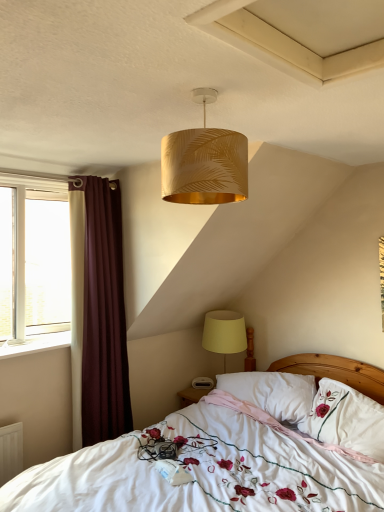
Question: Choose the correct answer: Is white soft pillow at center, which is the first pillow from left to right, inside burgundy fabric curtain at left or outside it?

Choices:
 (A) outside
 (B) inside

Answer: (A)

Question: From a real-world perspective, is white soft pillow at center, which is the first pillow from left to right, above or below burgundy fabric curtain at left?

Choices:
 (A) below
 (B) above

Answer: (A)

Question: Which object is the farthest from the white soft pillow at center, the 2th pillow in the right-to-left sequence?

Choices:
 (A) yellow fabric lampshade at lower right, which is the first lamp from bottom to top
 (B) gold leaf-patterned lampshade at upper center, acting as the first lamp starting from the top
 (C) white plastic window sill at left
 (D) burgundy fabric curtain at left
 (E) white embroidered pillow at center, which ranks as the second pillow in left-to-right order

Answer: (B)

Question: Which object is positioned closest to the yellow fabric lampshade at lower right, which is the first lamp from bottom to top?

Choices:
 (A) white plastic window sill at left
 (B) white soft pillow at center, which is the first pillow from left to right
 (C) white embroidered bed at center
 (D) gold leaf-patterned lampshade at upper center, marked as the 2th lamp in a back-to-front arrangement
 (E) white embroidered pillow at center, which is counted as the first pillow, starting from the right

Answer: (B)